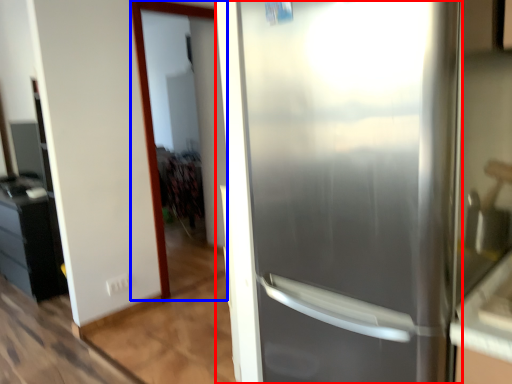
Question: Among these objects, which one is nearest to the camera, refrigerator (highlighted by a red box) or screen door (highlighted by a blue box)?

Choices:
 (A) refrigerator
 (B) screen door

Answer: (A)